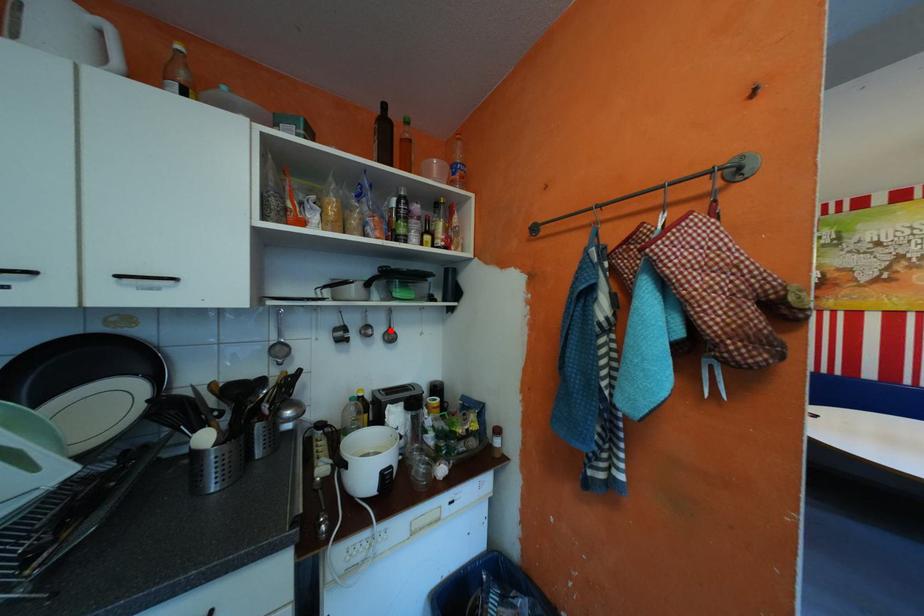
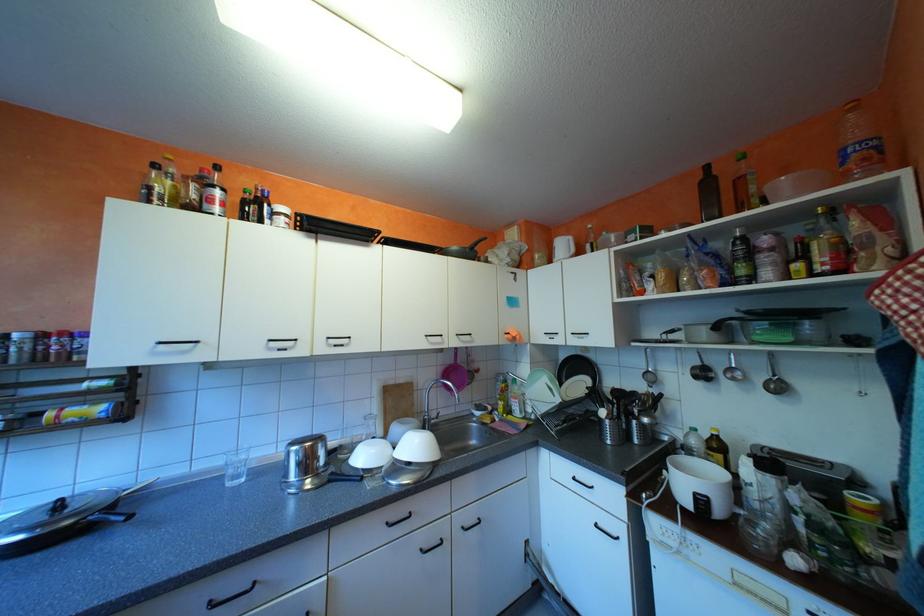
Where in the second image is the point corresponding to the highlighted location from the first image?

(772, 377)